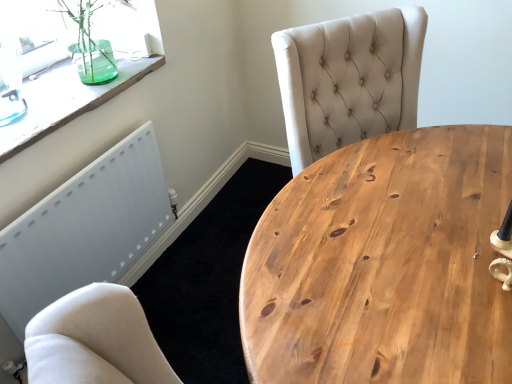
Question: Is transparent glass vase at upper left located outside white matte radiator at lower left?

Choices:
 (A) yes
 (B) no

Answer: (A)

Question: Is transparent glass vase at upper left bigger than white matte radiator at lower left?

Choices:
 (A) yes
 (B) no

Answer: (A)

Question: Is transparent glass vase at upper left aimed at white matte radiator at lower left?

Choices:
 (A) no
 (B) yes

Answer: (A)

Question: Is transparent glass vase at upper left behind white matte radiator at lower left?

Choices:
 (A) yes
 (B) no

Answer: (A)

Question: Would you say transparent glass vase at upper left is a long distance from white matte radiator at lower left?

Choices:
 (A) yes
 (B) no

Answer: (B)

Question: Is white matte radiator at lower left surrounded by transparent glass vase at upper left?

Choices:
 (A) yes
 (B) no

Answer: (B)

Question: Does white matte radiator at lower left have a smaller size compared to transparent glass vase at upper left?

Choices:
 (A) no
 (B) yes

Answer: (B)

Question: Is white matte radiator at lower left not within transparent glass vase at upper left?

Choices:
 (A) yes
 (B) no

Answer: (A)

Question: Is there a large distance between white matte radiator at lower left and transparent glass vase at upper left?

Choices:
 (A) yes
 (B) no

Answer: (B)

Question: Does white matte radiator at lower left have a larger size compared to transparent glass vase at upper left?

Choices:
 (A) no
 (B) yes

Answer: (A)

Question: Does white matte radiator at lower left come behind transparent glass vase at upper left?

Choices:
 (A) no
 (B) yes

Answer: (B)

Question: Considering the relative positions of white matte radiator at lower left and transparent glass vase at upper left in the image provided, is white matte radiator at lower left to the right of transparent glass vase at upper left from the viewer's perspective?

Choices:
 (A) no
 (B) yes

Answer: (B)

Question: Is natural wood table at center shorter than transparent glass vase at upper left?

Choices:
 (A) yes
 (B) no

Answer: (B)